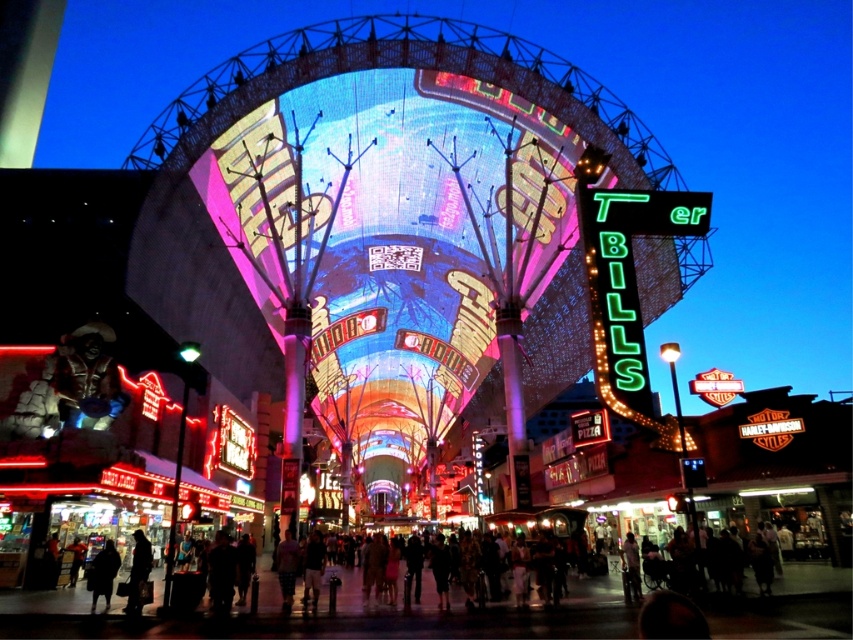
You are a photographer standing at the Fremont Street Experience in Las Vegas, and you want to capture both the dark clothing at lower left and the dark wool coat at lower left in your photo. Which item is positioned to the right of the other?

The dark clothing at lower left is positioned on the right side of dark wool coat at lower left.

You are a photographer standing at the Fremont Street Experience in Las Vegas. You want to capture a photo of the illuminated dome structure while ensuring that both the dark clothing at lower left and the dark wool coat at lower left are visible in the frame. Which object should you position closer to the edge of the frame to avoid overcrowding the composition?

Since the dark clothing at lower left might be wider than the dark wool coat at lower left, positioning the dark clothing at lower left closer to the edge would help avoid overcrowding the composition.

You are standing at the center of the Fremont Street Experience and want to find the dark clothing at lower left. Which direction should you turn to face it?

The dark clothing at lower left is located at point (138,572), which is to the lower left direction from your current position at the center. Turn left and look downward to face it.